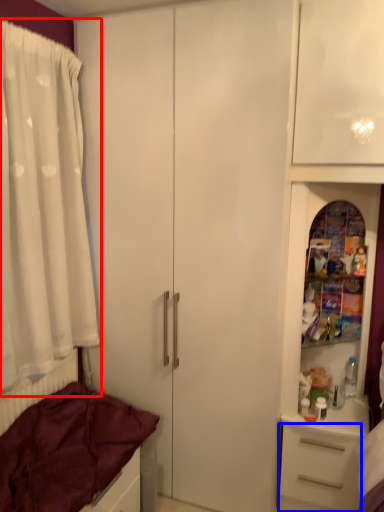
Question: Which object is closer to the camera taking this photo, curtain (highlighted by a red box) or drawer (highlighted by a blue box)?

Choices:
 (A) curtain
 (B) drawer

Answer: (A)